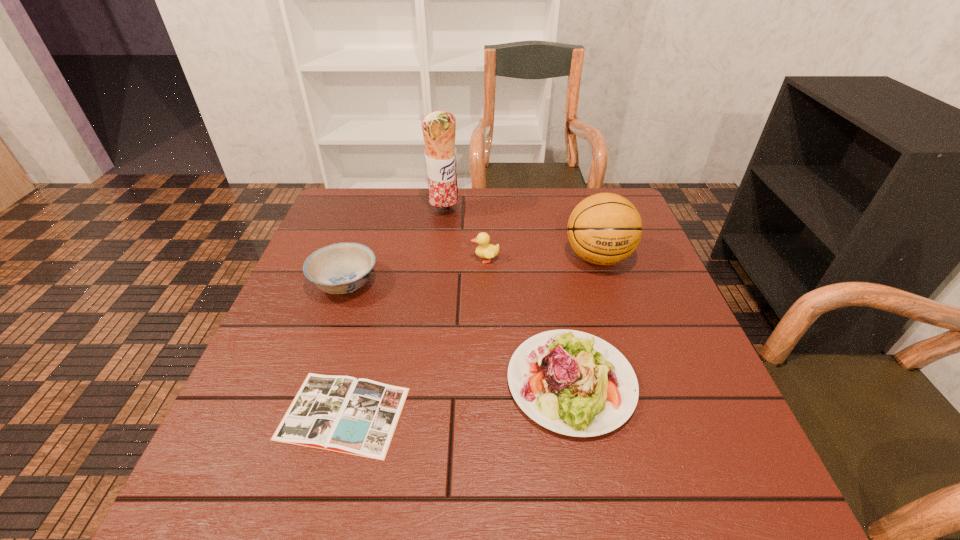
Where is `salad plate situated at the right edge`? salad plate situated at the right edge is located at coordinates (571, 382).

Identify the location of vacant space at the far edge of the desktop. This screenshot has width=960, height=540. (478, 220).

The height and width of the screenshot is (540, 960). I want to click on blank space at the near edge, so click(x=310, y=488).

Where is `vacant space at the right edge of the desktop`? The height and width of the screenshot is (540, 960). vacant space at the right edge of the desktop is located at coordinates (632, 262).

Identify the location of vacant space at the far left corner of the desktop. (354, 208).

You are a GUI agent. You are given a task and a screenshot of the screen. Output one action in this format:
    pyautogui.click(x=<x>, y=<y>)
    Task: Click on the free space at the near left corner of the desktop
    The image size is (960, 540).
    Given the screenshot: What is the action you would take?
    230,474

I want to click on free space between the shortest object and the second tallest object, so click(x=470, y=335).

Identify the location of vacant region between the burrito and the basketball. (521, 235).

I want to click on free point between the bowl and the salad plate, so click(458, 333).

Identify the location of free space between the burrito and the second tallest object. (521, 235).